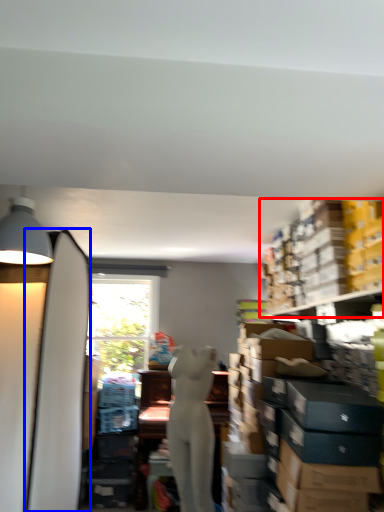
Question: Which object appears farthest to the camera in this image, shelf (highlighted by a red box) or surfboard (highlighted by a blue box)?

Choices:
 (A) shelf
 (B) surfboard

Answer: (A)